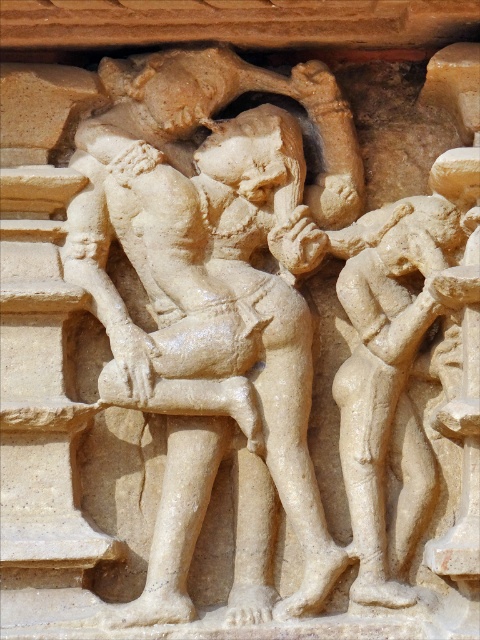
You are an art conservator standing 4 feet away from the stone relief. You need to examine the beige stone sculpture at center closely. Can you reach it without moving closer?

The beige stone sculpture at center is 3.91 feet from the viewer. Since you are standing 4 feet away, you are slightly farther than the sculpture, so you can just barely reach it without moving closer.

Based on the scene described, which object, the beige stone sculpture at center or the beige stone figure at right, has a greater width?

The beige stone sculpture at center might be wider than beige stone figure at right according to the description.